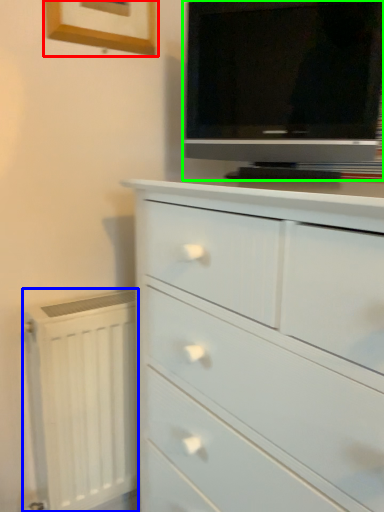
Question: Which object is positioned closest to picture frame (highlighted by a red box)? Select from radiator (highlighted by a blue box) and television (highlighted by a green box).

Choices:
 (A) radiator
 (B) television

Answer: (B)